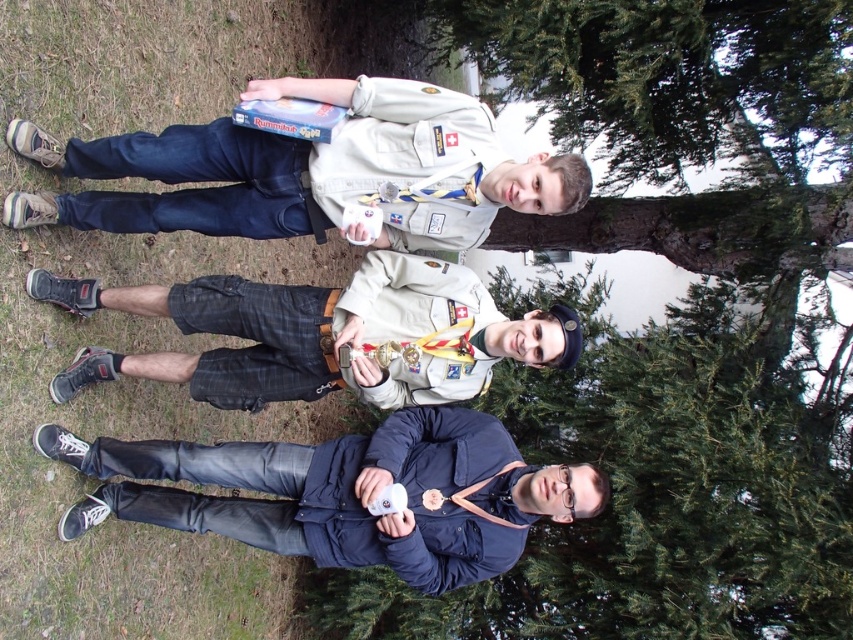
Question: Which point appears closest to the camera in this image?

Choices:
 (A) (409, 483)
 (B) (405, 128)
 (C) (393, 394)

Answer: (B)

Question: Does matte khaki uniform at center appear on the right side of dark blue fabric jacket at lower center?

Choices:
 (A) yes
 (B) no

Answer: (B)

Question: Is matte khaki uniform at center bigger than dark blue fabric jacket at lower center?

Choices:
 (A) yes
 (B) no

Answer: (B)

Question: Estimate the real-world distances between objects in this image. Which object is closer to the matte black shorts at center?

Choices:
 (A) matte khaki uniform at center
 (B) dark blue fabric jacket at lower center

Answer: (A)

Question: Can you confirm if matte khaki uniform at center is thinner than matte black shorts at center?

Choices:
 (A) no
 (B) yes

Answer: (B)

Question: Which of the following is the farthest from the observer?

Choices:
 (A) (204, 502)
 (B) (416, 161)
 (C) (486, 308)

Answer: (A)